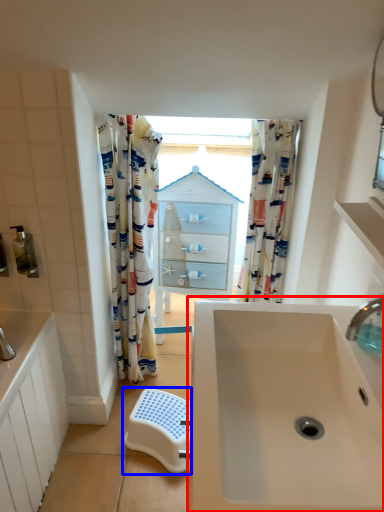
Question: Among these objects, which one is farthest to the camera, sink (highlighted by a red box) or step stool (highlighted by a blue box)?

Choices:
 (A) sink
 (B) step stool

Answer: (B)